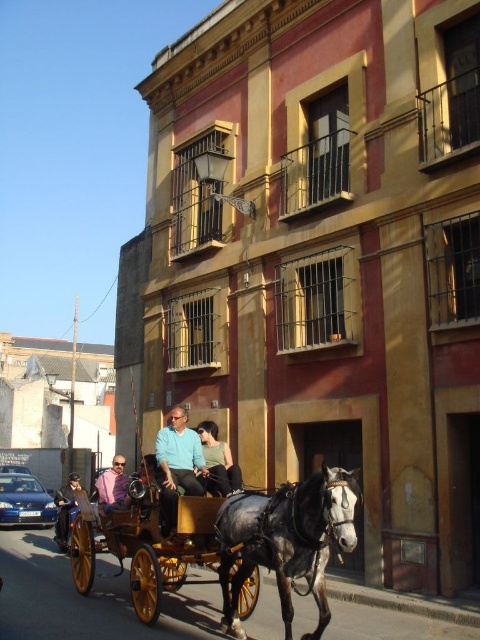
Question: Does wooden polished cart at center appear on the left side of pink fabric shirt at center?

Choices:
 (A) no
 (B) yes

Answer: (A)

Question: Which object is positioned closest to the pink fabric shirt at center?

Choices:
 (A) dark blue jeans at lower left
 (B) gray glossy horse at center

Answer: (B)

Question: Among these points, which one is farthest from the camera?

Choices:
 (A) (219, 470)
 (B) (317, 561)

Answer: (A)

Question: Which point appears closest to the camera in this image?

Choices:
 (A) (188, 458)
 (B) (222, 460)
 (C) (267, 528)

Answer: (C)

Question: Is black leather pants at center wider than dark blue jeans at lower left?

Choices:
 (A) no
 (B) yes

Answer: (A)

Question: Does matte blue shirt at center have a lesser width compared to dark blue jeans at lower left?

Choices:
 (A) yes
 (B) no

Answer: (A)